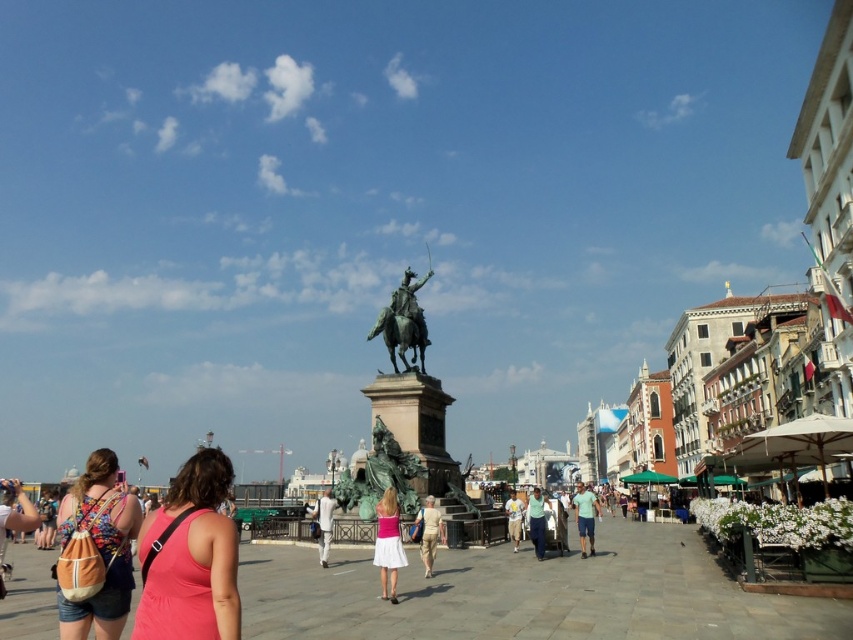
You are a photographer standing at the edge of the square. You want to take a photo of the pink satin dress at center without the green patinated bronze statue at center blocking the view. Is it possible to position yourself in such a way that the statue does not appear in the photo?

The green patinated bronze statue at center is located above the pink satin dress at center, so if you position yourself at the same level as the dress or lower, the statue might still block the view. However, if you can stand higher than the statue, you could potentially capture the dress without the statue obstructing it.

You are a photographer standing at the edge of the square and want to take a photo of both the green fabric shirt at center and the white cotton shirt at center. Since you want both shirts to be clearly visible in the photo, which shirt should you focus on first to ensure proper focus?

The green fabric shirt at center is larger in size than the white cotton shirt at center, so you should focus on the green fabric shirt at center first to ensure proper focus.